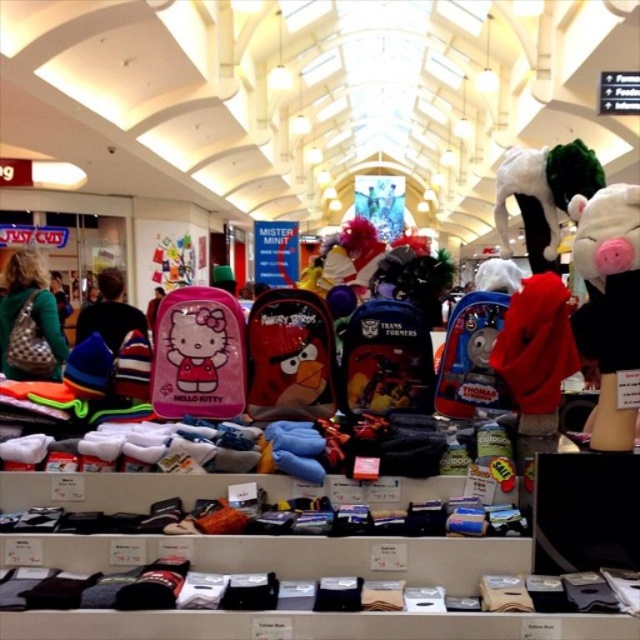
You are standing at the entrance of the mall and see two points marked in the image. Point A is at coordinates point [282,355] and Point B is at coordinates point [548,323]. Which point is closer to you?

Point B at point [548,323] is closer to you since it is in front of Point A at point [282,355].

You are a parent standing in the shopping mall and want to pick up the pink matte hello kitty backpack at center for your child. Can you reach it without needing a ladder or stepping stool?

The pink matte hello kitty backpack at center is 2.06 meters away from viewer. Since the backpack is positioned at a height of 2.06 meters, which is higher than the average adult reach height of around 2 meters, you might need a ladder or stepping stool to safely reach it.

You are a customer standing in the shopping mall and see the white plush pig at center. If you were to walk directly towards it from your current position, what direction should you move in?

Since the white plush pig at center is located at point 0.481 on the x and 0.953 on the y axis, you should move forward and slightly to the right to reach it.